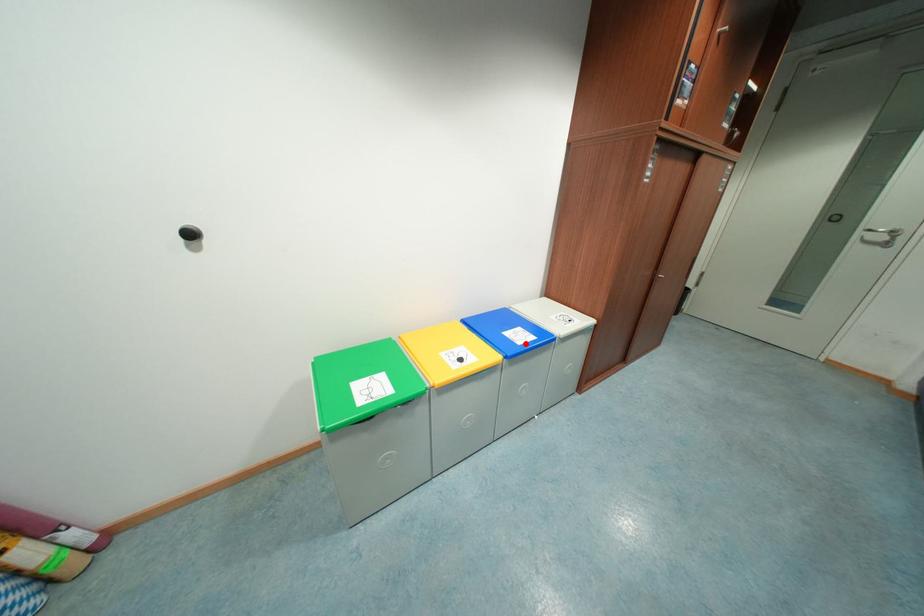
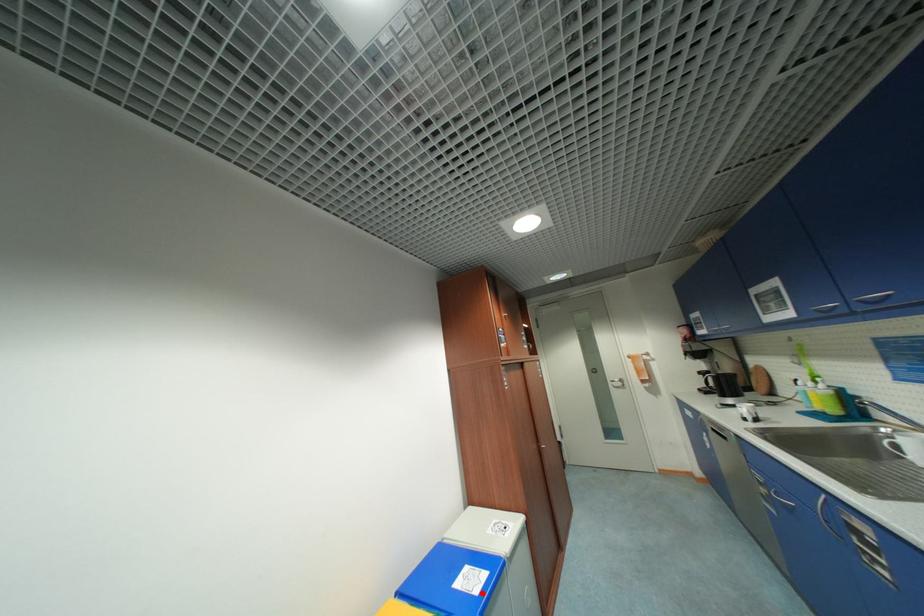
I am providing you with two images of the same scene from different viewpoints. A red point is marked on the first image and another point is marked on the second image. Is the red point in image1 aligned with the point shown in image2?

Yes